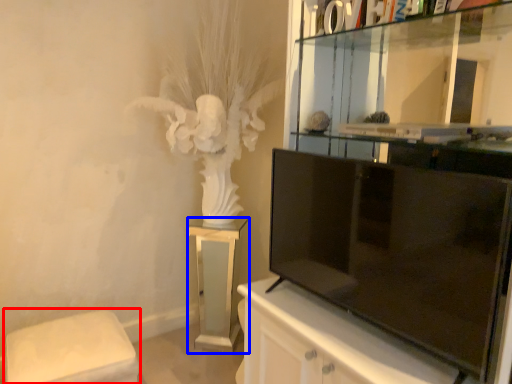
Question: Which object appears farthest to the camera in this image, furniture (highlighted by a red box) or furniture (highlighted by a blue box)?

Choices:
 (A) furniture
 (B) furniture

Answer: (B)